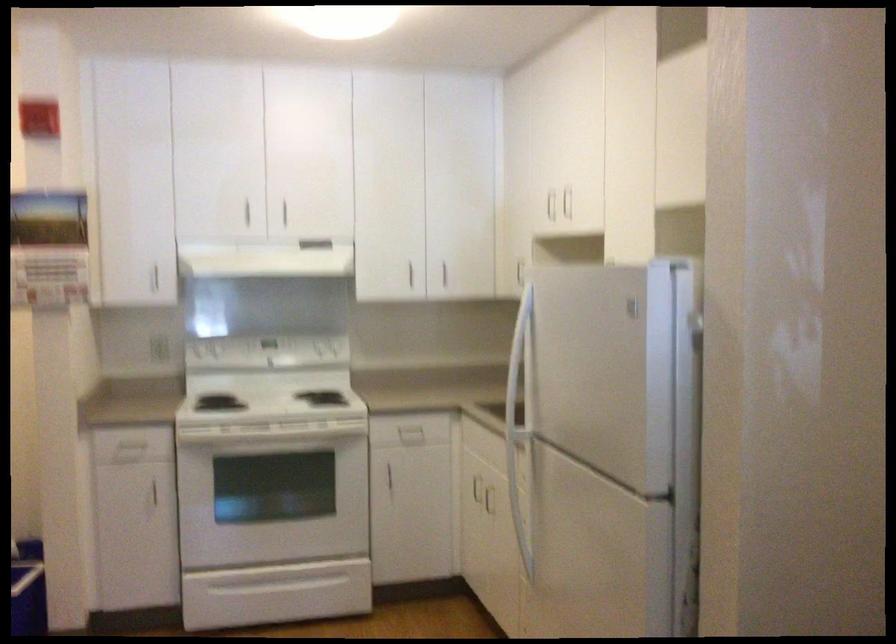
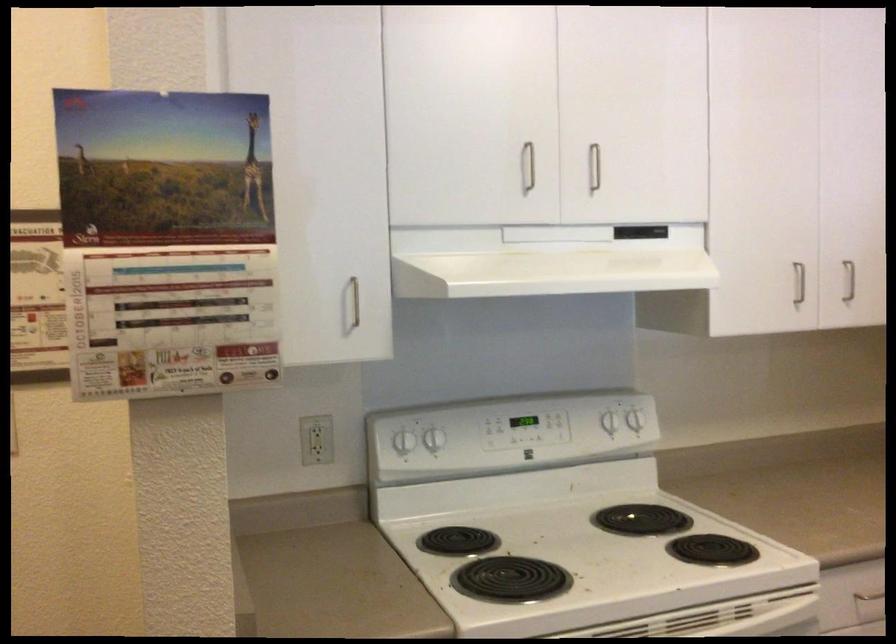
Locate, in the second image, the point that corresponds to point (409, 270) in the first image.

(798, 283)